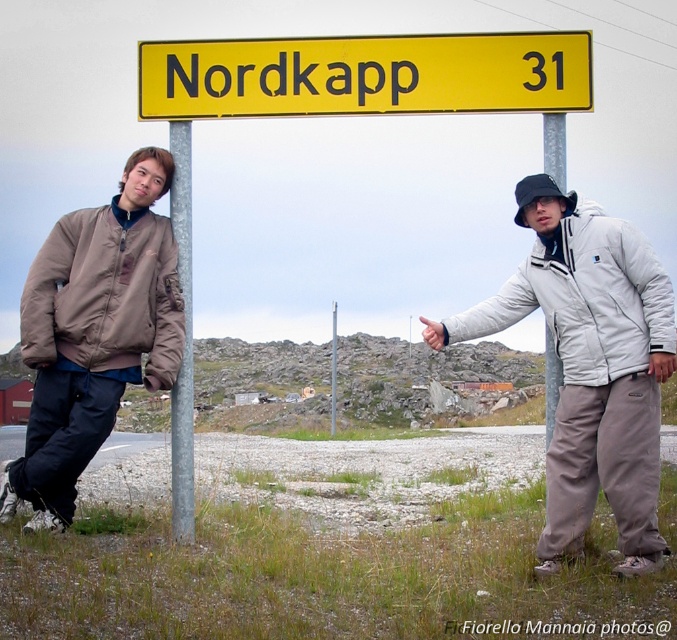
Is point (525, 205) behind point (190, 378)?

That is False.

Who is taller, white fleece jacket at right or silver metallic pole at left?

With more height is silver metallic pole at left.

What do you see at coordinates (589, 365) in the screenshot? The height and width of the screenshot is (640, 677). I see `white fleece jacket at right` at bounding box center [589, 365].

The image size is (677, 640). In order to click on white fleece jacket at right in this screenshot , I will do `click(589, 365)`.

Between white fleece jacket at right and matte brown bomber jacket at left, which one appears on the right side from the viewer's perspective?

white fleece jacket at right is more to the right.

From the picture: Between white fleece jacket at right and matte brown bomber jacket at left, which one is positioned higher?

Positioned higher is matte brown bomber jacket at left.

Is point (586, 433) in front of point (72, 412)?

Yes, it is.

Locate an element on the screen. This screenshot has width=677, height=640. white fleece jacket at right is located at coordinates (589, 365).

Which is in front, point (190, 365) or point (548, 353)?

Point (548, 353) is in front.

Between silver metallic pole at left and brushed metal pole at upper center, which one has less height?

With less height is silver metallic pole at left.

Between point (183, 380) and point (556, 401), which one is positioned behind?

The point (183, 380) is more distant.

The width and height of the screenshot is (677, 640). What are the coordinates of `silver metallic pole at left` in the screenshot? It's located at (183, 339).